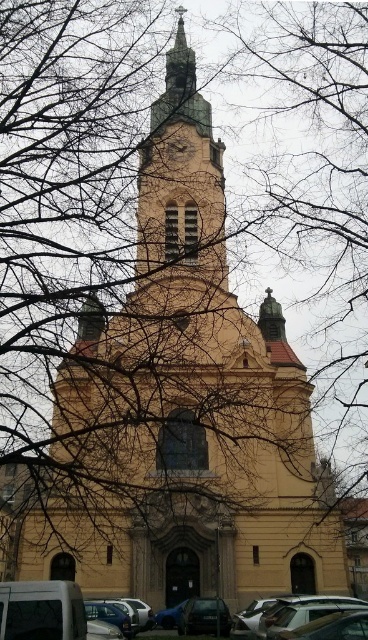
Is metallic silver car at lower right to the left of gold metallic clock at upper center from the viewer's perspective?

No, metallic silver car at lower right is not to the left of gold metallic clock at upper center.

Image resolution: width=368 pixels, height=640 pixels. Find the location of `metallic silver car at lower right`. metallic silver car at lower right is located at coordinates (122, 616).

The width and height of the screenshot is (368, 640). Identify the location of metallic silver car at lower right. (122, 616).